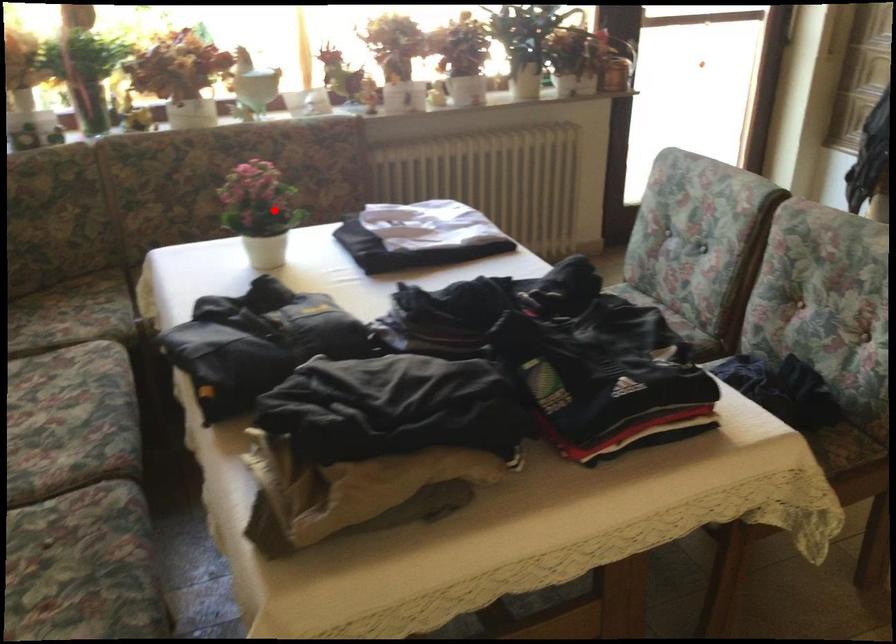
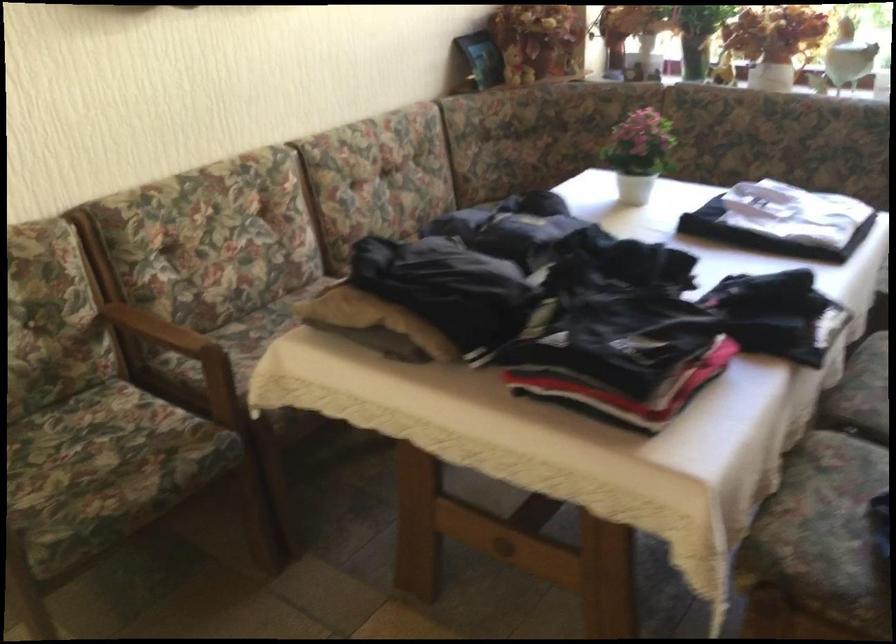
In the second image, find the point that corresponds to the highlighted location in the first image.

(639, 153)